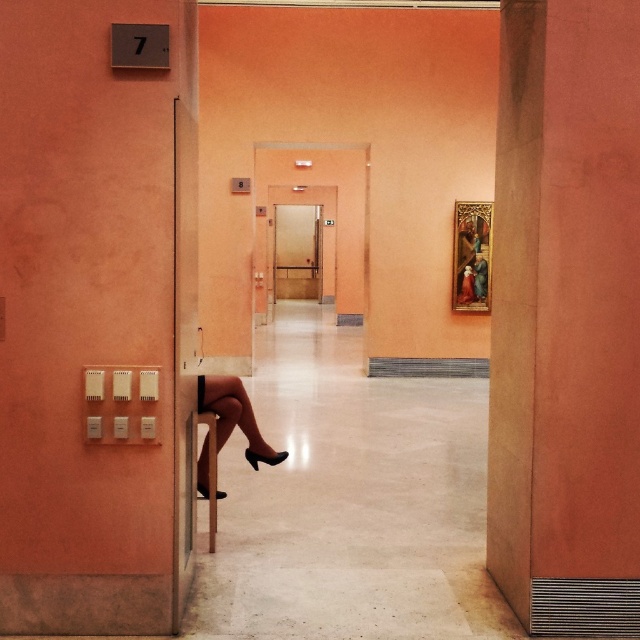
Based on the photo, you are standing at the entrance of the hallway and want to walk straight ahead. Is the smooth orange wall at center blocking your path to the matte black legs at lower left?

The smooth orange wall at center is in front of the matte black legs at lower left, so it is blocking the path between them. You would need to move around the wall to reach the matte black legs at lower left.

You are standing at the entrance of the hallway and want to touch the point at coordinates (x=566, y=317). Which wall should you walk towards to reach it?

The point at coordinates (x=566, y=317) is located on the smooth orange wall at center, so you should walk towards the smooth orange wall at center to reach it.

You are standing at the entrance of the hallway and need to reach the metallic elevator at center. Which direction should you move relative to the matte black legs at lower left to get there?

The metallic elevator at center is located above the matte black legs at lower left, so you should move forward towards the metallic elevator at center, away from the matte black legs at lower left.